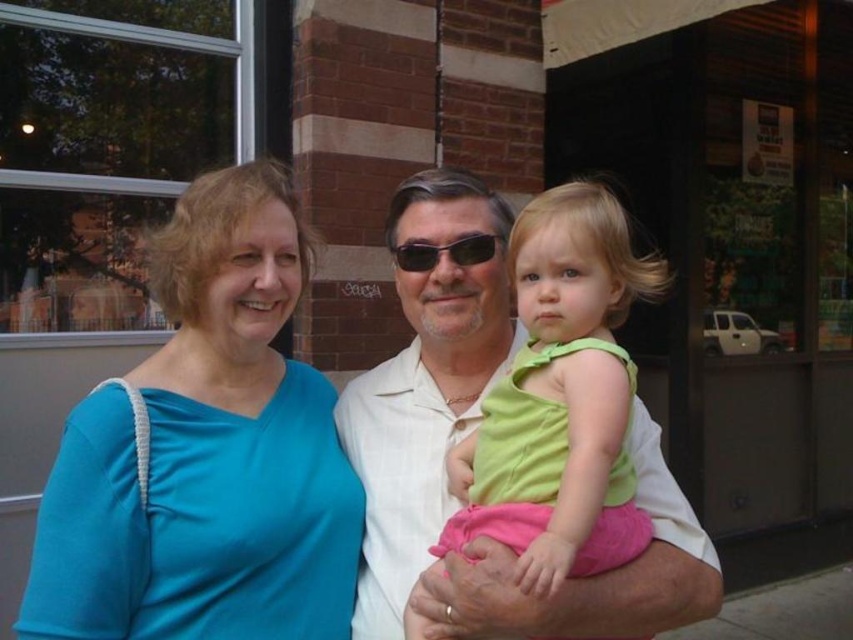
Question: Which point appears closest to the camera in this image?

Choices:
 (A) (328, 611)
 (B) (434, 592)
 (C) (483, 260)

Answer: (B)

Question: Which point is farther to the camera?

Choices:
 (A) white smooth shirt at center
 (B) black plastic sunglasses at center

Answer: (B)

Question: Can you confirm if blue fabric shirt at upper left is wider than white smooth shirt at center?

Choices:
 (A) yes
 (B) no

Answer: (B)

Question: Is blue fabric shirt at upper left wider than white smooth shirt at center?

Choices:
 (A) yes
 (B) no

Answer: (B)

Question: Which object is the closest to the black plastic sunglasses at center?

Choices:
 (A) blue fabric shirt at upper left
 (B) white smooth shirt at center

Answer: (B)

Question: Can you confirm if blue fabric shirt at upper left is bigger than black plastic sunglasses at center?

Choices:
 (A) no
 (B) yes

Answer: (B)